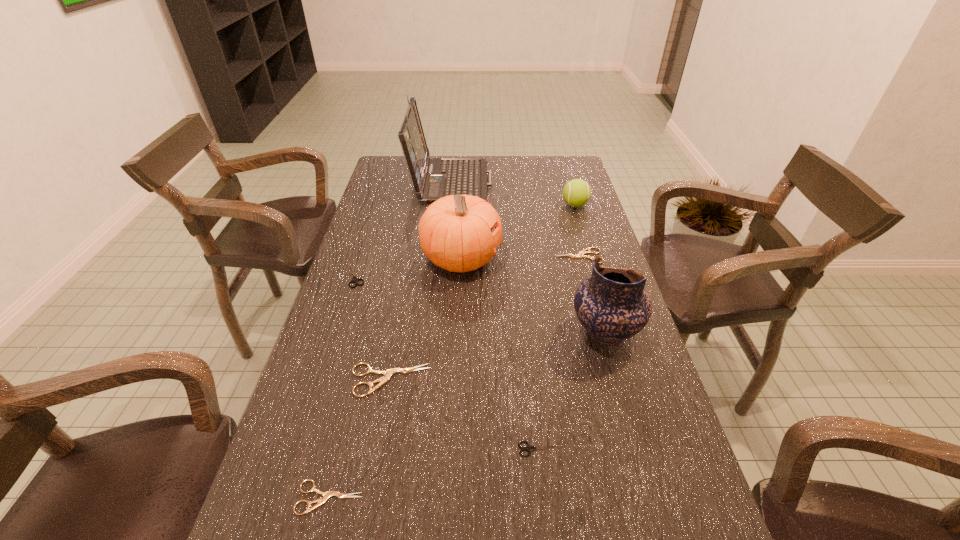
You are a GUI agent. You are given a task and a screenshot of the screen. Output one action in this format:
    pyautogui.click(x=<x>, y=<y>)
    Task: Click on the object that is positioned at the far left corner
    This screenshot has height=540, width=960.
    Given the screenshot: What is the action you would take?
    pyautogui.click(x=433, y=178)

Find the location of a particular element. The image size is (960, 540). free space at the far edge of the desktop is located at coordinates (501, 183).

Locate an element on the screen. free space at the left edge of the desktop is located at coordinates (382, 323).

In order to click on free space at the right edge in this screenshot , I will do `click(563, 206)`.

Identify the location of vacant area that lies between the rightmost beige shears and the right black shears. (560, 353).

Where is `free space between the nearest shears and the rightmost shears`? free space between the nearest shears and the rightmost shears is located at coordinates click(x=453, y=376).

This screenshot has width=960, height=540. Identify the location of free area in between the tennis ball and the second nearest object. (558, 327).

The height and width of the screenshot is (540, 960). I want to click on vacant point located between the rightmost beige shears and the laptop computer, so click(514, 218).

At what (x,y) coordinates should I click in order to perform the action: click on vacant space in between the eighth farthest object and the nearest shears. Please return your answer as a coordinate pair (x, y). The image size is (960, 540). Looking at the image, I should click on 436,473.

Where is `unoccupied position between the bigger black shears and the laptop computer`? The width and height of the screenshot is (960, 540). unoccupied position between the bigger black shears and the laptop computer is located at coordinates coord(403,227).